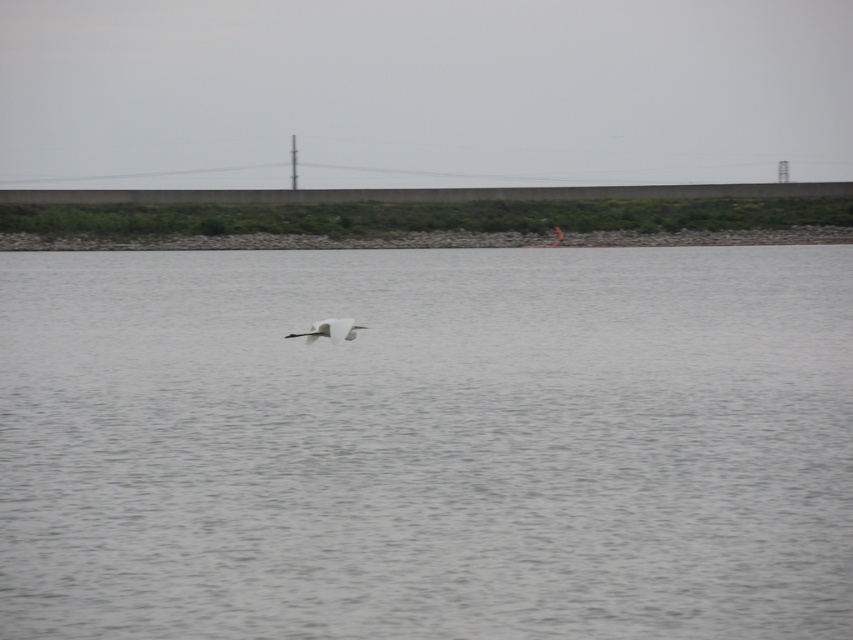
Question: Is the position of gray water at center more distant than that of white matte bird at center?

Choices:
 (A) yes
 (B) no

Answer: (B)

Question: Does gray water at center have a smaller size compared to white matte bird at center?

Choices:
 (A) yes
 (B) no

Answer: (B)

Question: Which of the following is the closest to the observer?

Choices:
 (A) white matte bird at center
 (B) gray water at center

Answer: (B)

Question: Which object appears closest to the camera in this image?

Choices:
 (A) gray water at center
 (B) white matte bird at center

Answer: (A)

Question: Which object is closer to the camera taking this photo?

Choices:
 (A) gray water at center
 (B) white matte bird at center

Answer: (A)

Question: Can you confirm if gray water at center is smaller than white matte bird at center?

Choices:
 (A) yes
 (B) no

Answer: (B)